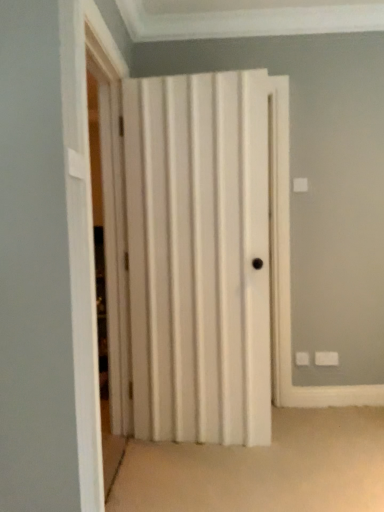
The height and width of the screenshot is (512, 384). Identify the location of vacant region below white wood folding door at center (from a real-world perspective). (130, 474).